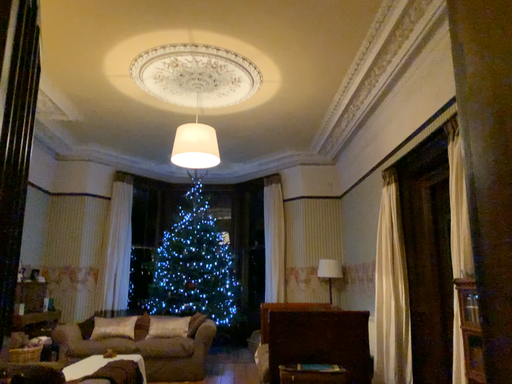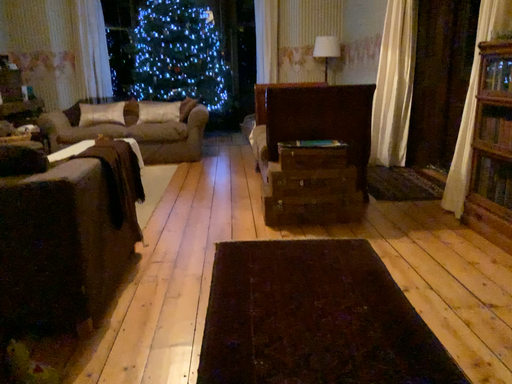
Question: How did the camera likely rotate when shooting the video?

Choices:
 (A) rotated upward
 (B) rotated downward

Answer: (B)